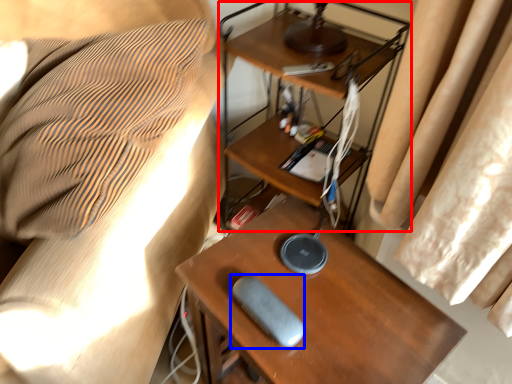
Question: Which point is closer to the camera, computer desk (highlighted by a red box) or equipment (highlighted by a blue box)?

Choices:
 (A) computer desk
 (B) equipment

Answer: (B)